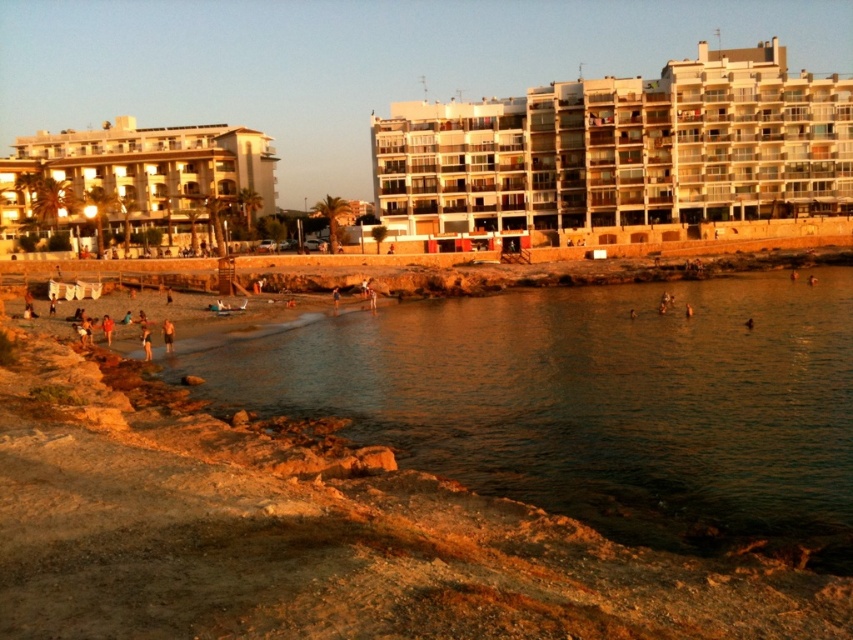
Question: Estimate the real-world distances between objects in this image. Which object is farther from the matte beige building at upper left?

Choices:
 (A) orange fabric person at lower left
 (B) shiny brown water at lower center

Answer: (B)

Question: Which point is farther to the camera?

Choices:
 (A) (662, 508)
 (B) (102, 323)
 (C) (170, 337)
 (D) (511, 115)

Answer: (D)

Question: Among these points, which one is farthest from the camera?

Choices:
 (A) (103, 332)
 (B) (683, 74)

Answer: (B)

Question: Is beige concrete building at upper right to the right of light brown sand at beach center from the viewer's perspective?

Choices:
 (A) yes
 (B) no

Answer: (A)

Question: In this image, where is shiny brown water at lower center located relative to light brown sand at beach center?

Choices:
 (A) right
 (B) left

Answer: (A)

Question: Is shiny brown water at lower center further to the viewer compared to light brown sand at beach center?

Choices:
 (A) yes
 (B) no

Answer: (B)